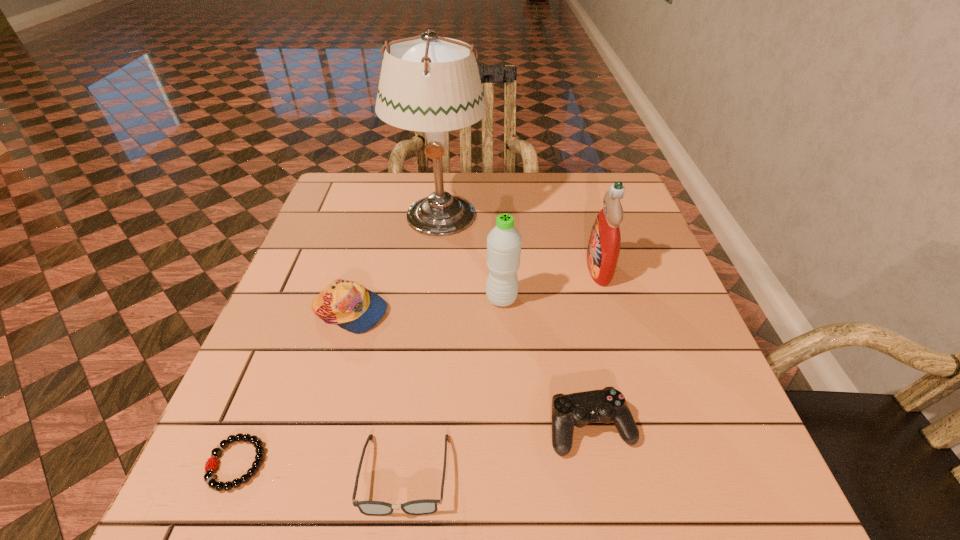
The image size is (960, 540). Identify the location of bracelet present at the left edge. (209, 478).

Identify the location of object that is at the right edge. The image size is (960, 540). (603, 250).

This screenshot has height=540, width=960. I want to click on object situated at the near left corner, so click(x=209, y=478).

In the image, there is a desktop. Find the location of `free region at the far edge`. free region at the far edge is located at coordinates click(x=488, y=173).

The image size is (960, 540). I want to click on vacant area at the near edge of the desktop, so click(x=564, y=461).

The width and height of the screenshot is (960, 540). Find the location of `vacant space at the left edge`. vacant space at the left edge is located at coordinates (345, 226).

This screenshot has height=540, width=960. Find the location of `vacant space at the right edge of the desktop`. vacant space at the right edge of the desktop is located at coordinates (618, 293).

Where is `free region at the far left corner`? free region at the far left corner is located at coordinates (353, 187).

This screenshot has height=540, width=960. In order to click on vacant area that lies between the farthest object and the cap in this screenshot , I will do point(395,264).

Where is `free space between the farthest object and the water bottle`? The width and height of the screenshot is (960, 540). free space between the farthest object and the water bottle is located at coordinates (470, 257).